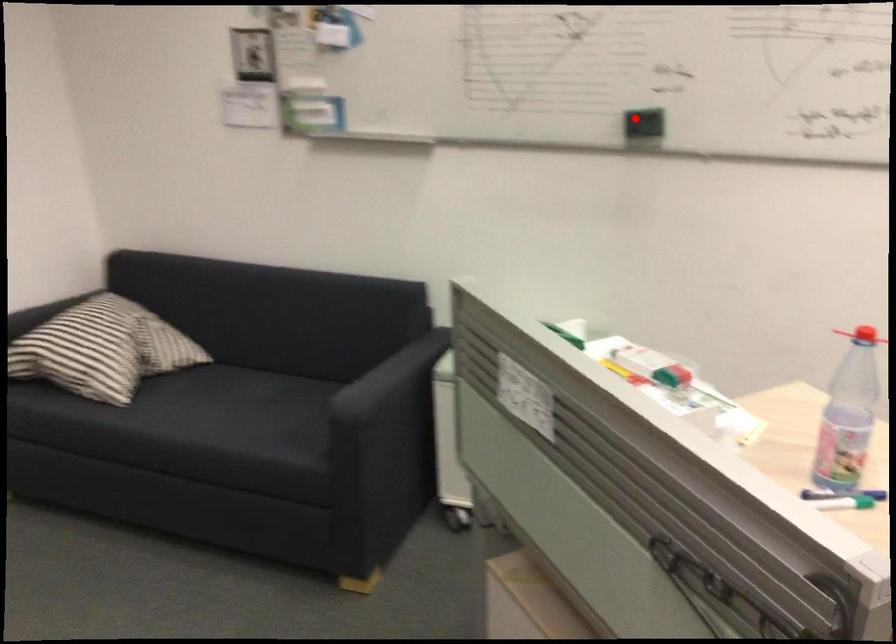
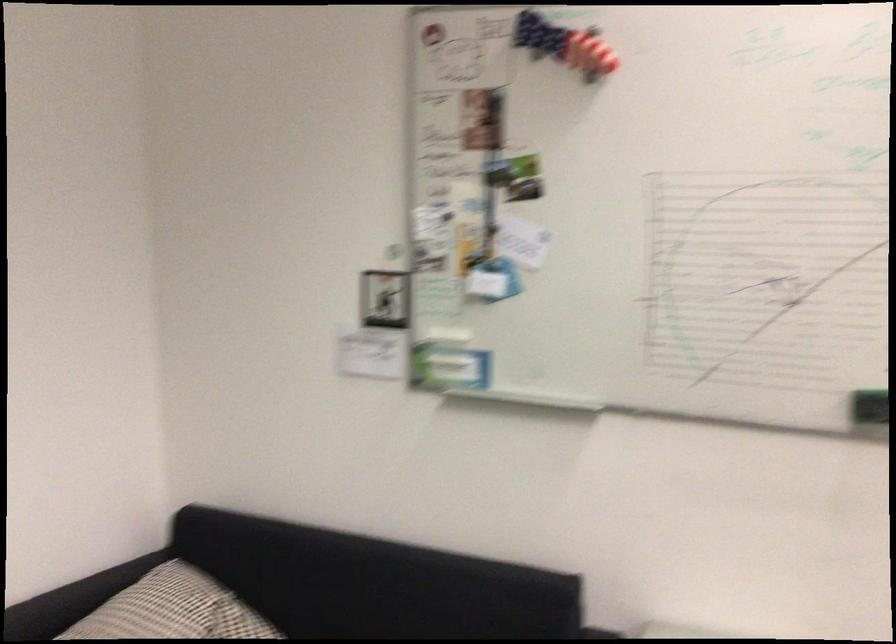
Question: I am providing you with two images of the same scene from different viewpoints. A red point is shown in image1. For the corresponding object point in image2, is it positioned nearer or farther from the camera?

Choices:
 (A) Nearer
 (B) Farther

Answer: (A)